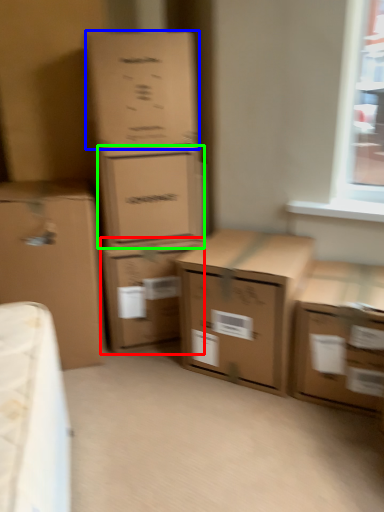
Question: Considering the real-world distances, which object is closest to box (highlighted by a red box)? box (highlighted by a blue box) or box (highlighted by a green box).

Choices:
 (A) box
 (B) box

Answer: (B)